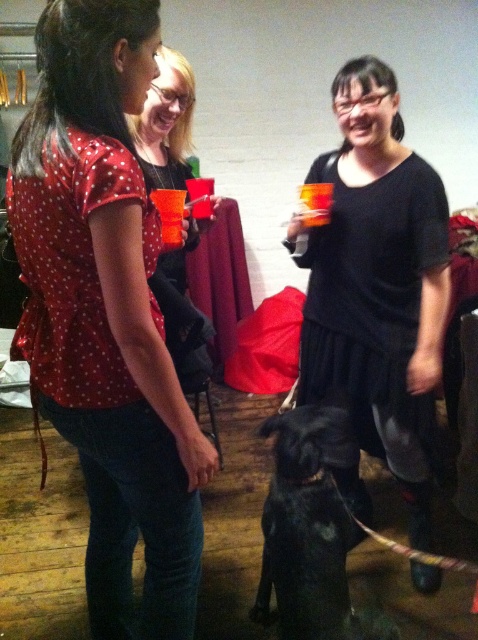
Which is above, black matte dress at center or matte black dress at center?

matte black dress at center

The width and height of the screenshot is (478, 640). I want to click on black matte dress at center, so pos(378,284).

Is matte red blouse at center wider than black matte dress at center?

No, matte red blouse at center is not wider than black matte dress at center.

How distant is matte red blouse at center from black matte dress at center?

matte red blouse at center and black matte dress at center are 31.08 inches apart.

Which is in front, point (148, 29) or point (431, 577)?

Point (148, 29) is more forward.

Locate an element on the screen. The height and width of the screenshot is (640, 478). matte red blouse at center is located at coordinates (107, 314).

Can you confirm if matte red blouse at center is bigger than black matte dog at center?

Indeed, matte red blouse at center has a larger size compared to black matte dog at center.

Is matte red blouse at center above black matte dog at center?

Yes.

Is point (113, 173) closer to viewer compared to point (340, 442)?

That is True.

Where is `matte red blouse at center`? This screenshot has height=640, width=478. matte red blouse at center is located at coordinates (107, 314).